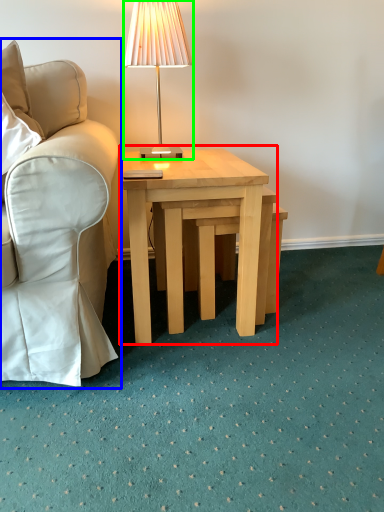
Question: Estimate the real-world distances between objects in this image. Which object is farther from coffee table (highlighted by a red box), chair (highlighted by a blue box) or lamp (highlighted by a green box)?

Choices:
 (A) chair
 (B) lamp

Answer: (B)